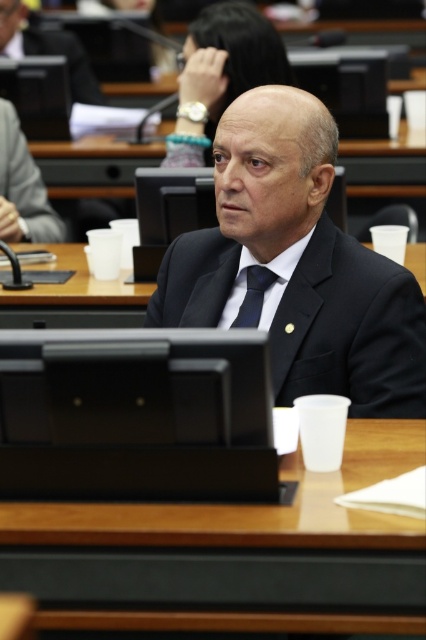
Does wooden table at center have a greater height compared to matte black suit at center?

Incorrect, wooden table at center's height is not larger of matte black suit at center's.

Does wooden table at center have a greater width compared to matte black suit at center?

Yes, wooden table at center is wider than matte black suit at center.

Does point (65, 596) come behind point (14, 168)?

No, (65, 596) is closer to viewer.

Identify the location of wooden table at center. This screenshot has height=640, width=426. (235, 552).

Does wooden table at center appear under black suit at center?

Correct, wooden table at center is located below black suit at center.

Is wooden table at center to the left of black suit at center from the viewer's perspective?

Incorrect, wooden table at center is not on the left side of black suit at center.

Who is more forward, (324, 488) or (2, 35)?

Positioned in front is point (324, 488).

This screenshot has height=640, width=426. What are the coordinates of `wooden table at center` in the screenshot? It's located at (235, 552).

Which is in front, point (290, 124) or point (58, 224)?

Point (290, 124) is more forward.

Does black matte suit at center have a smaller size compared to matte black suit at center?

Incorrect, black matte suit at center is not smaller in size than matte black suit at center.

Is point (281, 173) less distant than point (11, 148)?

Yes, it is.

Where is `black matte suit at center`? This screenshot has width=426, height=640. black matte suit at center is located at coordinates point(296,264).